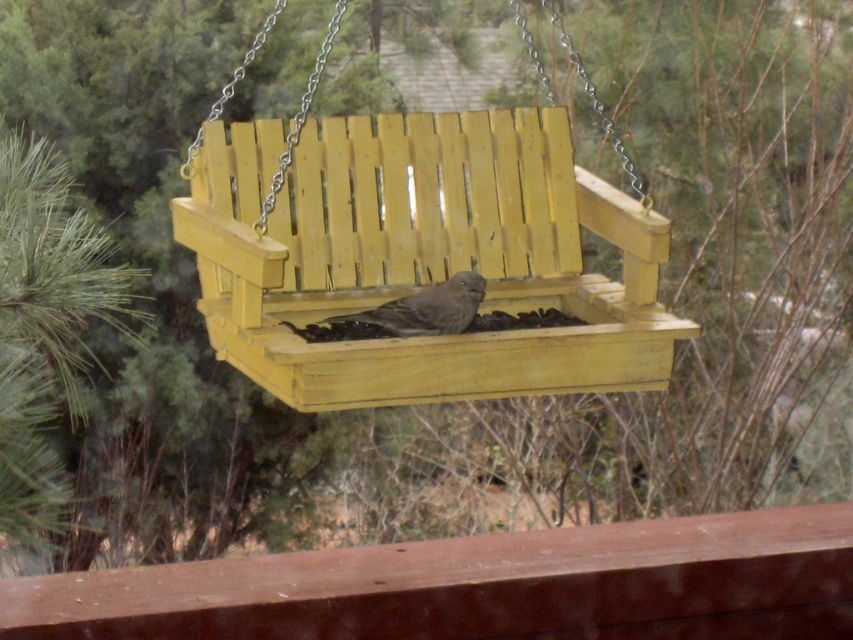
You are standing at the center of the deck and want to place a new bird feeder. There are two points marked on the deck where you can place it. The first point is at point (361, 384) and the second is at point (445, 330). Which point is closer to you?

Point (361, 384) is in front of point (445, 330), so the first point is closer to you.

You are standing at the center of a garden and see the yellow wood swing at center. If you walk straight ahead, will you reach the swing before the edge of the garden?

The yellow wood swing at center is located at point (416, 252), so if you walk straight ahead from the garden center, you will reach the swing before the edge of the garden.

You are a bird trying to land on the yellow wood swing at center to eat the birdseed. Considering the size of the swing and the bird, will there be enough space for the brown matte bird at center to comfortably perch alongside you?

The yellow wood swing at center is larger in size than the brown matte bird at center, so there should be enough space for the brown matte bird at center to comfortably perch alongside.